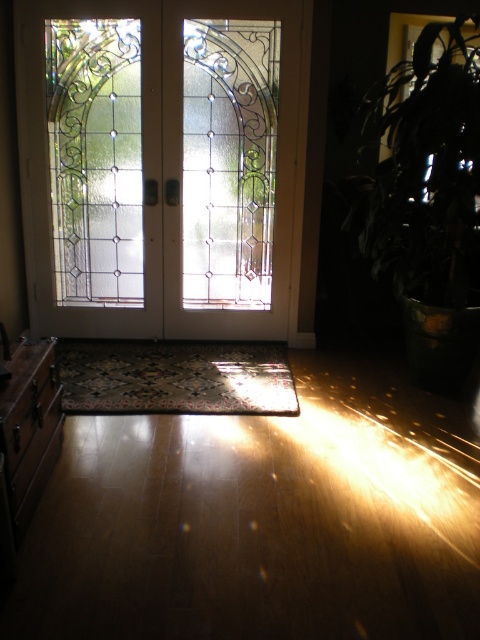
Question: Is dark green leafy plant at right to the right of carpeted mat at center from the viewer's perspective?

Choices:
 (A) yes
 (B) no

Answer: (A)

Question: Is clear glass doors at center to the left of carpeted mat at center from the viewer's perspective?

Choices:
 (A) no
 (B) yes

Answer: (A)

Question: Among these points, which one is nearest to the camera?

Choices:
 (A) (90, 412)
 (B) (190, 184)
 (C) (425, 176)

Answer: (C)

Question: Where is clear glass doors at center located in relation to dark green leafy plant at right in the image?

Choices:
 (A) below
 (B) above

Answer: (B)

Question: Which point is farther from the camera taking this photo?

Choices:
 (A) (84, 360)
 (B) (226, 243)
 (C) (386, 124)

Answer: (B)

Question: Which object is positioned farthest from the dark green leafy plant at right?

Choices:
 (A) clear glass doors at center
 (B) carpeted mat at center

Answer: (B)